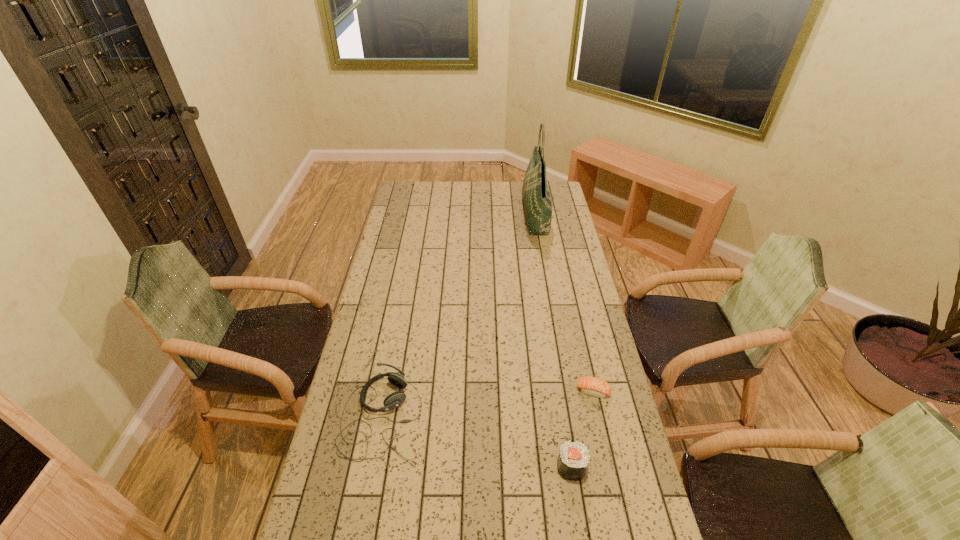
Identify the location of blank space located on the back of the shortest object. (586, 355).

Locate an element on the screen. object located in the far edge section of the desktop is located at coordinates (536, 197).

The image size is (960, 540). In order to click on object located at the left edge in this screenshot , I will do `click(395, 399)`.

Find the location of a particular element. This screenshot has height=540, width=960. tote bag positioned at the right edge is located at coordinates (536, 197).

Locate an element on the screen. This screenshot has height=540, width=960. object at the far right corner is located at coordinates (536, 197).

Locate an element on the screen. Image resolution: width=960 pixels, height=540 pixels. free space at the far edge of the desktop is located at coordinates (502, 184).

This screenshot has height=540, width=960. In the image, there is a desktop. What are the coordinates of `free space at the left edge` in the screenshot? It's located at (x=362, y=355).

Locate an element on the screen. vacant area at the right edge of the desktop is located at coordinates (564, 239).

Image resolution: width=960 pixels, height=540 pixels. I want to click on free spot at the far right corner of the desktop, so [x=558, y=189].

At what (x,y) coordinates should I click in order to perform the action: click on free area in between the shortest object and the left sushi. Please return your answer as a coordinate pair (x, y). Looking at the image, I should click on (583, 429).